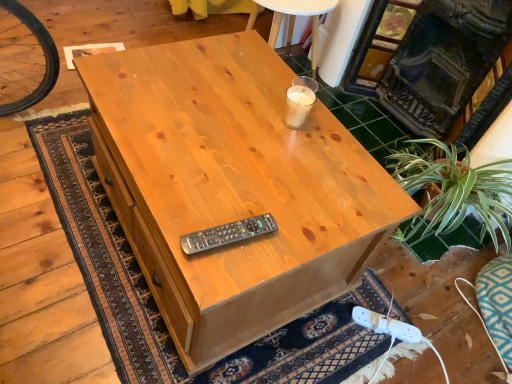
Question: Can you confirm if white plastic plug at lower right is positioned to the left of natural wood desk at center?

Choices:
 (A) no
 (B) yes

Answer: (A)

Question: Is white plastic plug at lower right aimed at natural wood desk at center?

Choices:
 (A) yes
 (B) no

Answer: (A)

Question: Is white plastic plug at lower right positioned before natural wood desk at center?

Choices:
 (A) no
 (B) yes

Answer: (A)

Question: Considering the relative sizes of white plastic plug at lower right and natural wood desk at center in the image provided, is white plastic plug at lower right bigger than natural wood desk at center?

Choices:
 (A) no
 (B) yes

Answer: (A)

Question: From a real-world perspective, is white plastic plug at lower right on top of natural wood desk at center?

Choices:
 (A) no
 (B) yes

Answer: (A)

Question: From the image's perspective, relative to white plastic plug at lower right, is natural wood desk at center above or below?

Choices:
 (A) below
 (B) above

Answer: (B)

Question: In terms of size, does natural wood desk at center appear bigger or smaller than white plastic plug at lower right?

Choices:
 (A) big
 (B) small

Answer: (A)

Question: Considering their positions, is natural wood desk at center located in front of or behind white plastic plug at lower right?

Choices:
 (A) front
 (B) behind

Answer: (A)

Question: Is natural wood desk at center to the left or to the right of white plastic plug at lower right in the image?

Choices:
 (A) left
 (B) right

Answer: (A)

Question: Is white plastic plug at lower right wider or thinner than natural wood desk at center?

Choices:
 (A) thin
 (B) wide

Answer: (A)

Question: From a real-world perspective, is white plastic plug at lower right positioned above or below natural wood desk at center?

Choices:
 (A) below
 (B) above

Answer: (A)

Question: Would you say white plastic plug at lower right is inside or outside natural wood desk at center?

Choices:
 (A) outside
 (B) inside

Answer: (A)

Question: From the image's perspective, is white plastic plug at lower right above or below natural wood desk at center?

Choices:
 (A) above
 (B) below

Answer: (B)

Question: From a real-world perspective, is dark gray stone fireplace at upper right above or below black plastic remote at center?

Choices:
 (A) above
 (B) below

Answer: (B)

Question: Considering the positions of point (413, 105) and point (258, 228), is point (413, 105) closer or farther from the camera than point (258, 228)?

Choices:
 (A) farther
 (B) closer

Answer: (A)